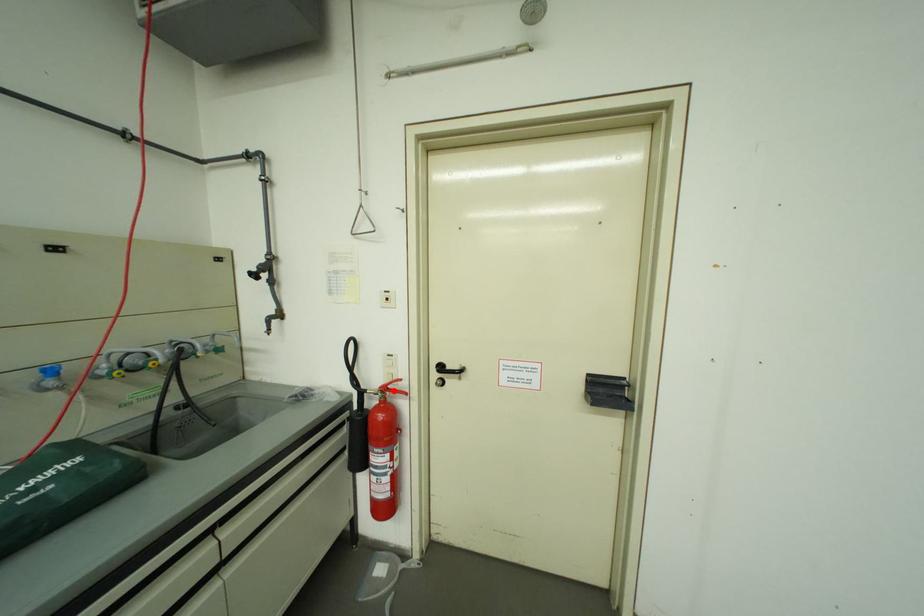
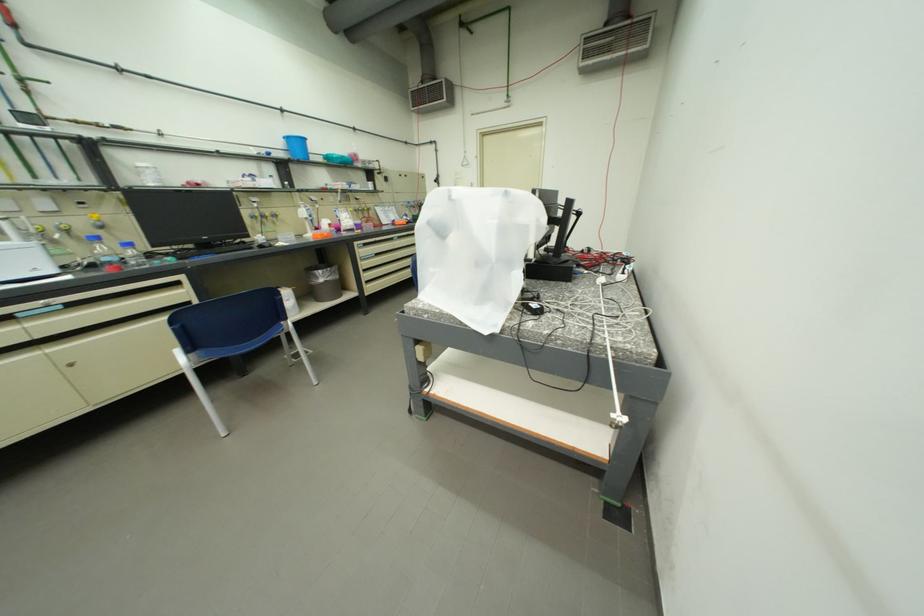
Question: I am providing you with two images of the same scene from different viewpoints. A red point is marked on the first image. At the location where the point appears in image 1, is it still visible in image 2?

Choices:
 (A) Yes
 (B) No

Answer: (B)